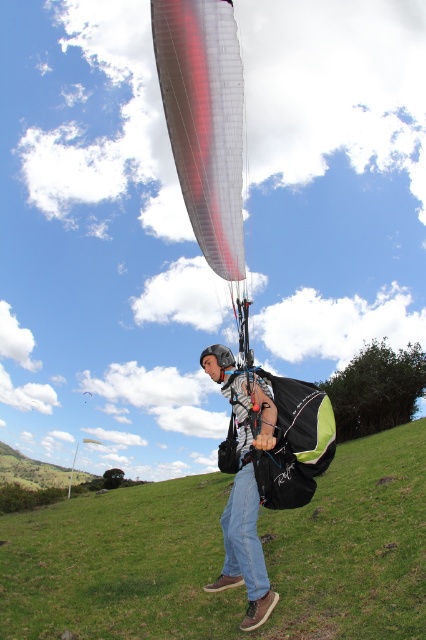
Does red translucent fabric parachute at center come in front of denim jeans at center?

No, red translucent fabric parachute at center is further to the viewer.

Between red translucent fabric parachute at center and denim jeans at center, which one has more height?

With more height is red translucent fabric parachute at center.

The image size is (426, 640). Find the location of `red translucent fabric parachute at center`. red translucent fabric parachute at center is located at coordinates pyautogui.click(x=204, y=120).

Between green grassy field at lower center and denim jeans at center, which one appears on the right side from the viewer's perspective?

Positioned to the right is green grassy field at lower center.

Which is behind, point (396, 513) or point (250, 499)?

The point (396, 513) is behind.

Where is `green grassy field at lower center`? This screenshot has height=640, width=426. green grassy field at lower center is located at coordinates (221, 556).

Between green grassy field at lower center and red translucent fabric parachute at center, which one has less height?

red translucent fabric parachute at center is shorter.

Is green grassy field at lower center below red translucent fabric parachute at center?

Indeed, green grassy field at lower center is positioned under red translucent fabric parachute at center.

Which is in front, point (371, 484) or point (226, 148)?

Point (226, 148) is in front.

Identify the location of green grassy field at lower center. Image resolution: width=426 pixels, height=640 pixels. (221, 556).